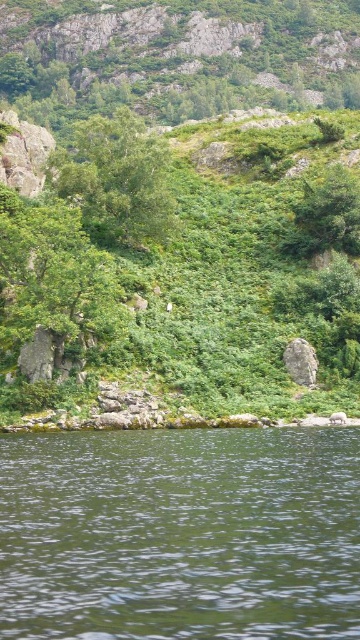
Is point (216, 497) less distant than point (96, 228)?

Yes, it is in front of point (96, 228).

Describe the element at coordinates (181, 534) in the screenshot. I see `green liquid water at bottom` at that location.

Where is `green liquid water at bottom`? The width and height of the screenshot is (360, 640). green liquid water at bottom is located at coordinates (181, 534).

Between point (136, 506) and point (104, 292), which one is positioned in front?

Point (136, 506) is more forward.

Between green liquid water at bottom and green leafy tree at left, which one has more height?

With more height is green leafy tree at left.

What are the coordinates of `green liquid water at bottom` in the screenshot? It's located at (181, 534).

Based on the photo, does green leafy tree at left have a lesser height compared to green leafy tree at upper center?

Yes, green leafy tree at left is shorter than green leafy tree at upper center.

Is point (52, 240) positioned behind point (114, 113)?

No, (52, 240) is closer to viewer.

Does point (50, 296) come farther from viewer compared to point (59, 152)?

No, it is not.

The height and width of the screenshot is (640, 360). I want to click on green leafy tree at left, so tap(52, 275).